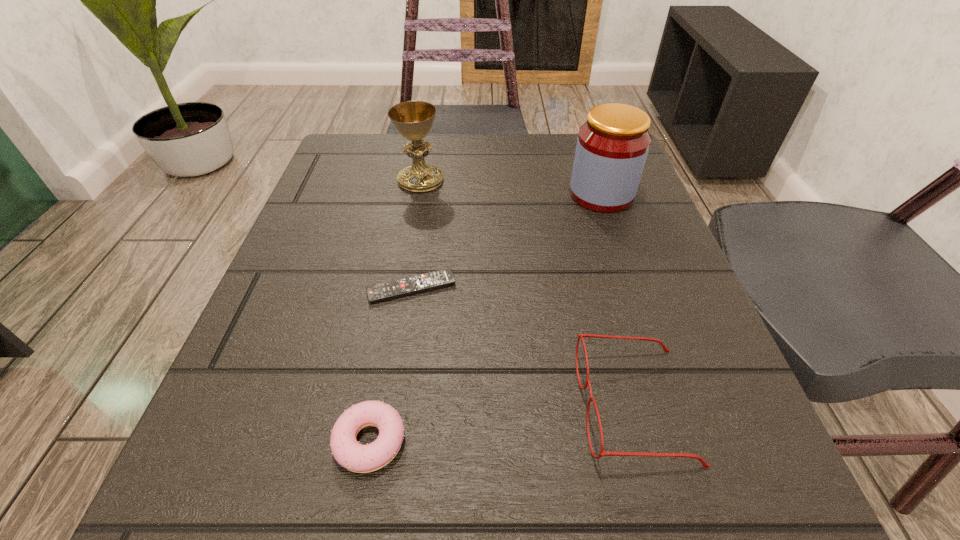
Where is `vacant point located between the jar and the third farthest object`? vacant point located between the jar and the third farthest object is located at coordinates (507, 241).

Where is `object that ranks as the closest to the second shortest object`? This screenshot has height=540, width=960. object that ranks as the closest to the second shortest object is located at coordinates (411, 285).

Locate which object ranks in proximity to the jar. Please provide its 2D coordinates. Your answer should be formatted as a tuple, i.e. [(x, y)], where the tuple contains the x and y coordinates of a point satisfying the conditions above.

[(413, 120)]

The image size is (960, 540). I want to click on free spot that satisfies the following two spatial constraints: 1. on the front side of the jar; 2. on the face of the third tallest object, so click(x=673, y=406).